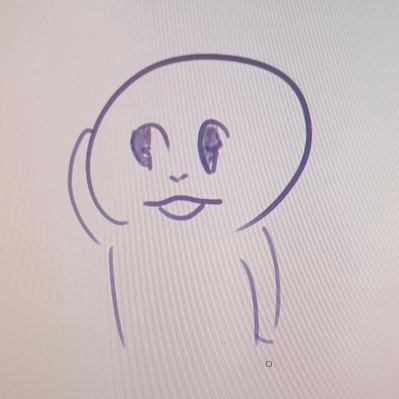
The width and height of the screenshot is (399, 399). Identify the location of chest. (188, 289).